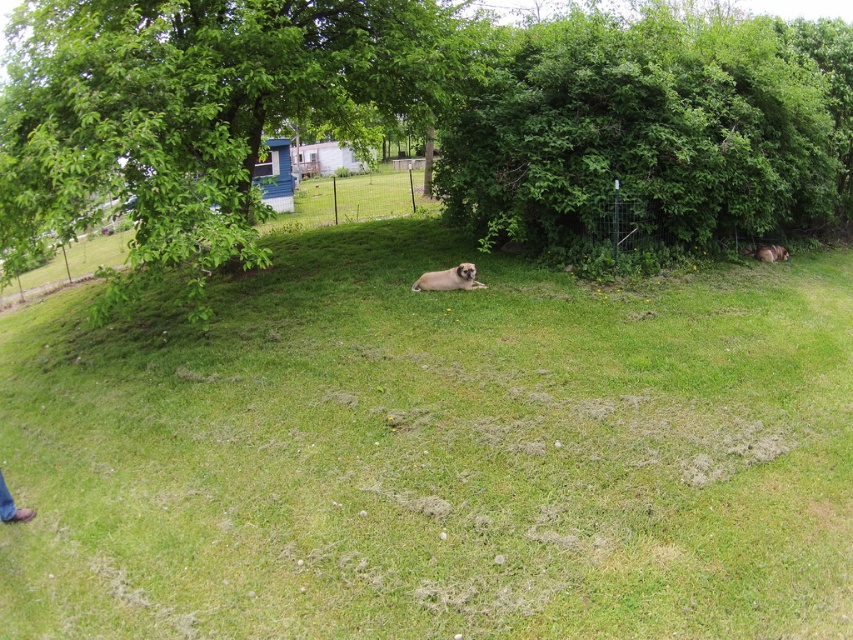
Question: Does green grassy at center appear on the right side of brown furry dog at center?

Choices:
 (A) no
 (B) yes

Answer: (A)

Question: Which point is farther to the camera?

Choices:
 (A) (822, 54)
 (B) (358, 250)
 (C) (62, 141)

Answer: (A)

Question: Which point appears closest to the camera in this image?

Choices:
 (A) (780, 189)
 (B) (41, 144)
 (C) (413, 288)

Answer: (B)

Question: Is green leafy bush at center to the right of brown leather shoes at lower left from the viewer's perspective?

Choices:
 (A) yes
 (B) no

Answer: (A)

Question: Is green leafy bush at center wider than brown furry dog at lower right?

Choices:
 (A) yes
 (B) no

Answer: (B)

Question: Estimate the real-world distances between objects in this image. Which object is closer to the green grassy at center?

Choices:
 (A) brown leather shoes at lower left
 (B) brown furry dog at lower right

Answer: (A)